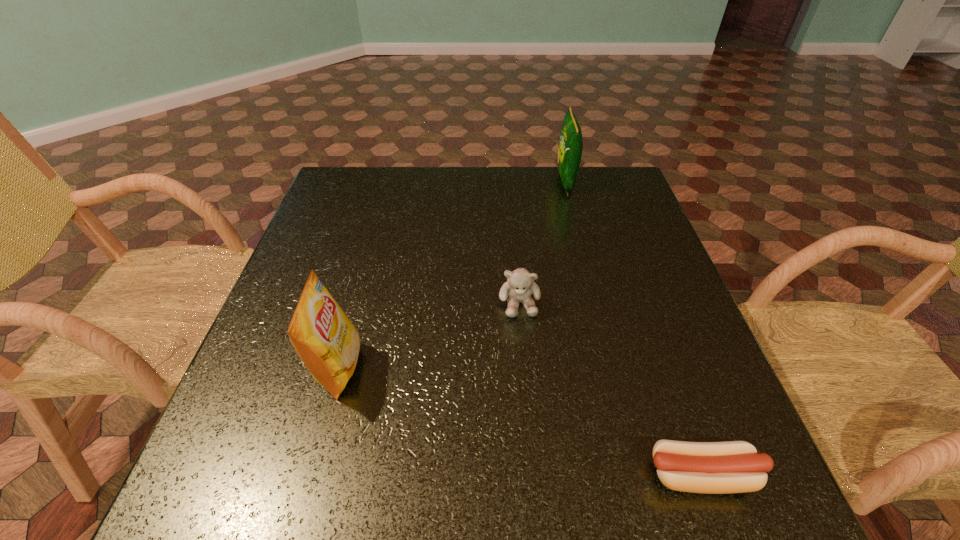
Find the location of a particular element. Image resolution: width=960 pixels, height=540 pixels. the right crisp (potato chip) is located at coordinates (570, 147).

Find the location of `the farthest object`. the farthest object is located at coordinates (570, 147).

The image size is (960, 540). Identify the location of the third farthest object. (325, 339).

The image size is (960, 540). What are the coordinates of `the left crisp (potato chip)` in the screenshot? It's located at (325, 339).

At what (x,y) coordinates should I click in order to perform the action: click on the third object from right to left. Please return your answer as a coordinate pair (x, y). Looking at the image, I should click on (520, 285).

This screenshot has width=960, height=540. I want to click on the second shortest object, so click(x=520, y=285).

The width and height of the screenshot is (960, 540). What are the coordinates of `the shortest object` in the screenshot? It's located at click(727, 467).

Locate an element on the screen. sausage is located at coordinates (727, 467).

The image size is (960, 540). What are the coordinates of `vacant space located on the front-facing side of the right crisp (potato chip)` in the screenshot? It's located at (486, 182).

Where is `vacant space situated on the front-facing side of the right crisp (potato chip)`? This screenshot has width=960, height=540. vacant space situated on the front-facing side of the right crisp (potato chip) is located at coordinates (516, 182).